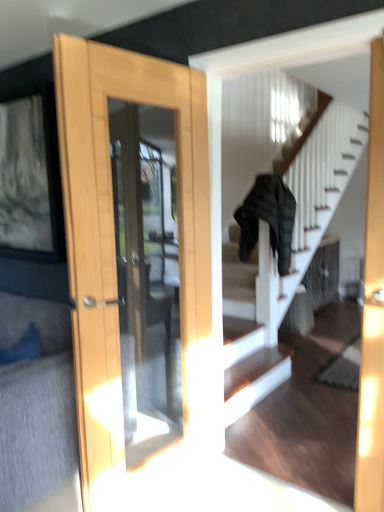
Question: Should I look upward or downward to see black fabric jacket at center?

Choices:
 (A) down
 (B) up

Answer: (B)

Question: Is textured gray couch at lower left wider than black fabric jacket at center?

Choices:
 (A) no
 (B) yes

Answer: (A)

Question: Can you confirm if textured gray couch at lower left is shorter than black fabric jacket at center?

Choices:
 (A) yes
 (B) no

Answer: (A)

Question: Considering the relative sizes of textured gray couch at lower left and black fabric jacket at center in the image provided, is textured gray couch at lower left thinner than black fabric jacket at center?

Choices:
 (A) yes
 (B) no

Answer: (A)

Question: Does textured gray couch at lower left have a smaller size compared to black fabric jacket at center?

Choices:
 (A) no
 (B) yes

Answer: (B)

Question: Is textured gray couch at lower left oriented away from black fabric jacket at center?

Choices:
 (A) no
 (B) yes

Answer: (A)

Question: Is textured gray couch at lower left aimed at black fabric jacket at center?

Choices:
 (A) no
 (B) yes

Answer: (A)

Question: Is black fabric jacket at center placed right next to textured gray couch at lower left?

Choices:
 (A) yes
 (B) no

Answer: (B)

Question: Is black fabric jacket at center wider than textured gray couch at lower left?

Choices:
 (A) no
 (B) yes

Answer: (B)

Question: Does black fabric jacket at center have a smaller size compared to textured gray couch at lower left?

Choices:
 (A) no
 (B) yes

Answer: (A)

Question: Is black fabric jacket at center far away from textured gray couch at lower left?

Choices:
 (A) yes
 (B) no

Answer: (A)

Question: Can you confirm if black fabric jacket at center is thinner than textured gray couch at lower left?

Choices:
 (A) yes
 (B) no

Answer: (B)

Question: Can you confirm if black fabric jacket at center is positioned to the right of textured gray couch at lower left?

Choices:
 (A) yes
 (B) no

Answer: (A)

Question: Is textured gray couch at lower left situated inside black fabric jacket at center or outside?

Choices:
 (A) outside
 (B) inside

Answer: (A)